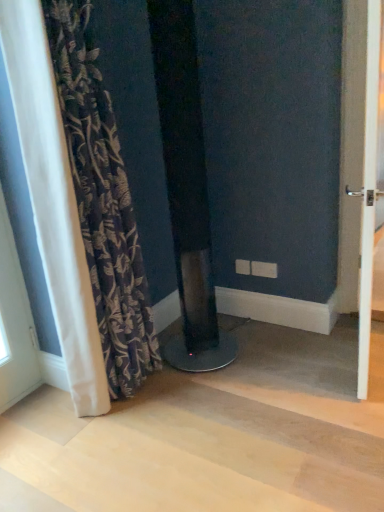
What do you see at coordinates (102, 200) in the screenshot?
I see `dark floral fabric curtain at left` at bounding box center [102, 200].

What is the approximate height of dark floral fabric curtain at left?

5.52 feet.

The image size is (384, 512). Find the location of `dark floral fabric curtain at left`. dark floral fabric curtain at left is located at coordinates (102, 200).

The image size is (384, 512). What do you see at coordinates (368, 192) in the screenshot? I see `white glossy door at right` at bounding box center [368, 192].

You are a GUI agent. You are given a task and a screenshot of the screen. Output one action in this format:
    pyautogui.click(x=<x>, y=<y>)
    Task: Click on the white glossy door at right
    The image size is (384, 512).
    Given the screenshot: What is the action you would take?
    pyautogui.click(x=368, y=192)

I want to click on dark floral fabric curtain at left, so click(102, 200).

Between dark floral fabric curtain at left and white glossy door at right, which one appears on the right side from the viewer's perspective?

Positioned to the right is white glossy door at right.

Which object is further away from the camera, dark floral fabric curtain at left or white glossy door at right?

dark floral fabric curtain at left is further from the camera.

Does point (81, 35) come in front of point (374, 224)?

Yes, it is in front of point (374, 224).

From the image's perspective, is dark floral fabric curtain at left located above white glossy door at right?

No.

From a real-world perspective, who is located higher, dark floral fabric curtain at left or white glossy door at right?

In real-world perspective, dark floral fabric curtain at left is above.

Between dark floral fabric curtain at left and white glossy door at right, which one has larger width?

dark floral fabric curtain at left.

Considering the sizes of objects dark floral fabric curtain at left and white glossy door at right in the image provided, who is shorter, dark floral fabric curtain at left or white glossy door at right?

white glossy door at right.

Considering the relative sizes of dark floral fabric curtain at left and white glossy door at right in the image provided, is dark floral fabric curtain at left smaller than white glossy door at right?

No, dark floral fabric curtain at left is not smaller than white glossy door at right.

Is dark floral fabric curtain at left spatially inside white glossy door at right, or outside of it?

dark floral fabric curtain at left exists outside the volume of white glossy door at right.

Looking at this image, is dark floral fabric curtain at left far away from white glossy door at right?

dark floral fabric curtain at left is far away from white glossy door at right.

Could you tell me if dark floral fabric curtain at left is turned towards white glossy door at right?

No, dark floral fabric curtain at left is not aimed at white glossy door at right.

How many degrees apart are the facing directions of dark floral fabric curtain at left and white glossy door at right?

dark floral fabric curtain at left and white glossy door at right are facing 11.3 degrees away from each other.

I want to click on screen door above the dark floral fabric curtain at left (from the image's perspective), so click(368, 192).

Which object is positioned more to the right, white glossy door at right or dark floral fabric curtain at left?

From the viewer's perspective, white glossy door at right appears more on the right side.

Which object is closer to the camera taking this photo, white glossy door at right or dark floral fabric curtain at left?

white glossy door at right is more forward.

Considering the positions of point (364, 329) and point (82, 202), is point (364, 329) closer or farther from the camera than point (82, 202)?

Point (364, 329) is positioned farther from the camera compared to point (82, 202).

From the image's perspective, is white glossy door at right under dark floral fabric curtain at left?

No, from the image's perspective, white glossy door at right is not below dark floral fabric curtain at left.

From a real-world perspective, is white glossy door at right positioned above or below dark floral fabric curtain at left?

white glossy door at right is below dark floral fabric curtain at left.

Between white glossy door at right and dark floral fabric curtain at left, which one has larger width?

dark floral fabric curtain at left.

Does white glossy door at right have a greater height compared to dark floral fabric curtain at left?

No.

Looking at this image, who is smaller, white glossy door at right or dark floral fabric curtain at left?

white glossy door at right is smaller.

Is white glossy door at right inside or outside of dark floral fabric curtain at left?

white glossy door at right lies outside dark floral fabric curtain at left.

Is white glossy door at right far from dark floral fabric curtain at left?

Indeed, white glossy door at right is not near dark floral fabric curtain at left.

Is white glossy door at right positioned with its back to dark floral fabric curtain at left?

Absolutely, white glossy door at right is directed away from dark floral fabric curtain at left.

How different are the orientations of white glossy door at right and dark floral fabric curtain at left in degrees?

The angular difference between white glossy door at right and dark floral fabric curtain at left is 11.3 degrees.

In the image, there is a white glossy door at right. Identify the location of curtain below it (from the image's perspective). (x=102, y=200).

The width and height of the screenshot is (384, 512). What are the coordinates of `curtain that appears on the left of white glossy door at right` in the screenshot? It's located at (102, 200).

Find the location of `curtain below the white glossy door at right (from the image's perspective)`. curtain below the white glossy door at right (from the image's perspective) is located at coordinates (102, 200).